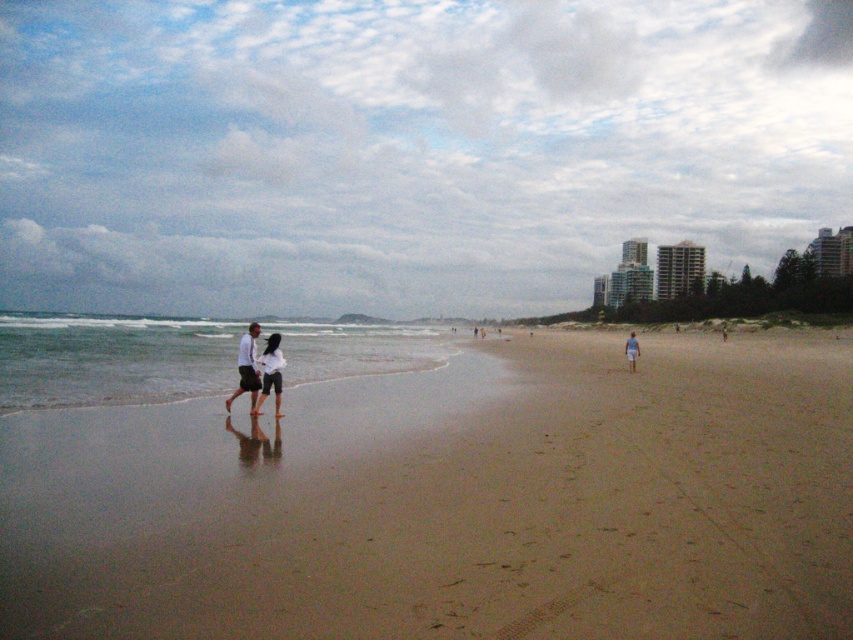
You are standing on the brown sandy beach at center and want to place a small flag at the highest point between it and the white fabric shorts at center. Which object should you place the flag on?

The white fabric shorts at center is taller than the brown sandy beach at center, so you should place the flag on the white fabric shorts at center.